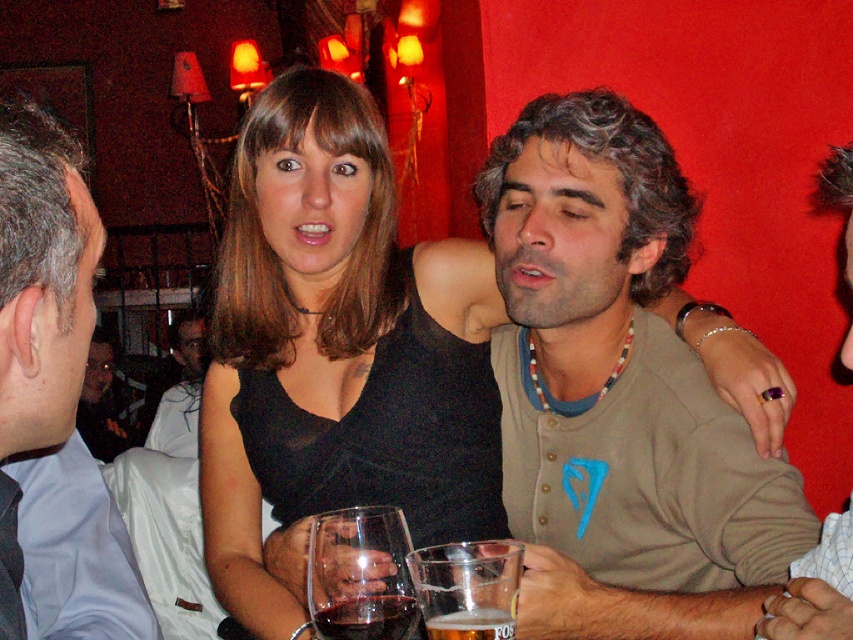
Is gray hair at left thinner than dark glass at lower center?

Incorrect, gray hair at left's width is not less than dark glass at lower center's.

How much distance is there between gray hair at left and dark glass at lower center?

gray hair at left and dark glass at lower center are 14.55 inches apart.

Who is more forward, [6,204] or [383,614]?

Point [6,204]

You are a GUI agent. You are given a task and a screenshot of the screen. Output one action in this format:
    pyautogui.click(x=<x>, y=<y>)
    Task: Click on the gray hair at left
    Image resolution: width=853 pixels, height=640 pixels.
    Given the screenshot: What is the action you would take?
    pyautogui.click(x=42, y=280)

Who is positioned more to the right, matte gray sweater at center or foamy golden beer at lower center?

From the viewer's perspective, matte gray sweater at center appears more on the right side.

Who is more forward, (563, 595) or (457, 611)?

Point (457, 611) is more forward.

Where is `matte gray sweater at center`? The image size is (853, 640). matte gray sweater at center is located at coordinates (618, 394).

Where is `matte gray sweater at center`? The height and width of the screenshot is (640, 853). matte gray sweater at center is located at coordinates (618, 394).

Does gray hair at left appear on the right side of clear glass at lower center?

Incorrect, gray hair at left is not on the right side of clear glass at lower center.

Does gray hair at left come in front of clear glass at lower center?

Yes, gray hair at left is closer to the viewer.

Where is `gray hair at left`? Image resolution: width=853 pixels, height=640 pixels. gray hair at left is located at coordinates (42, 280).

The image size is (853, 640). In order to click on gray hair at left in this screenshot , I will do `click(42, 280)`.